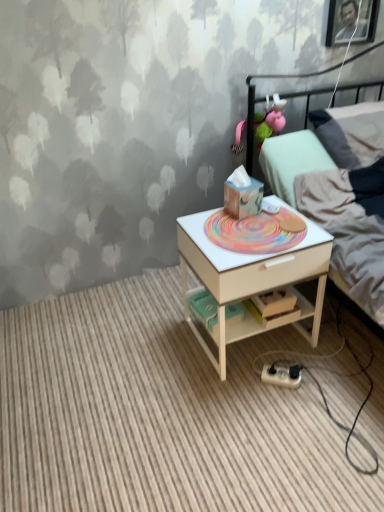
Locate an element on the screen. free spot behind white plastic power strip at lower center is located at coordinates (274, 350).